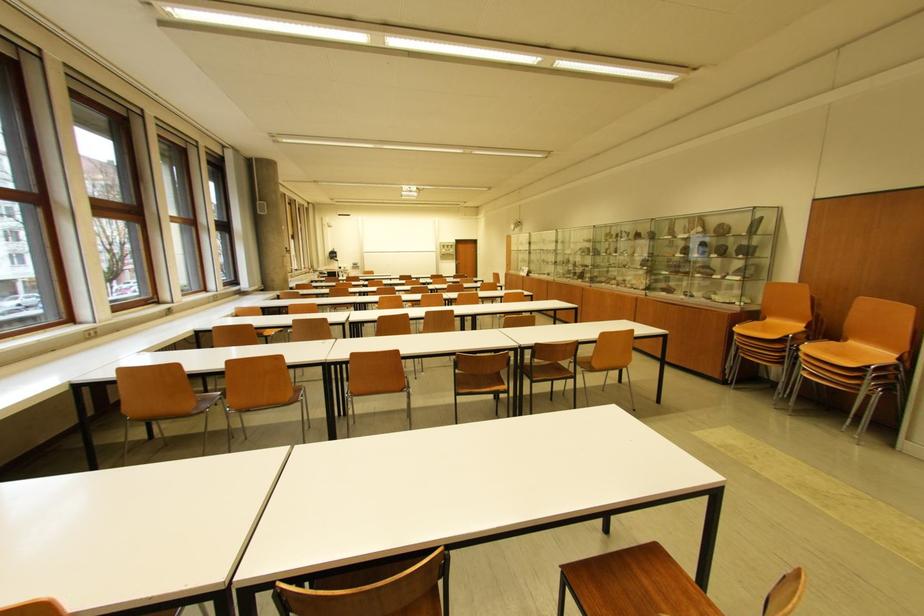
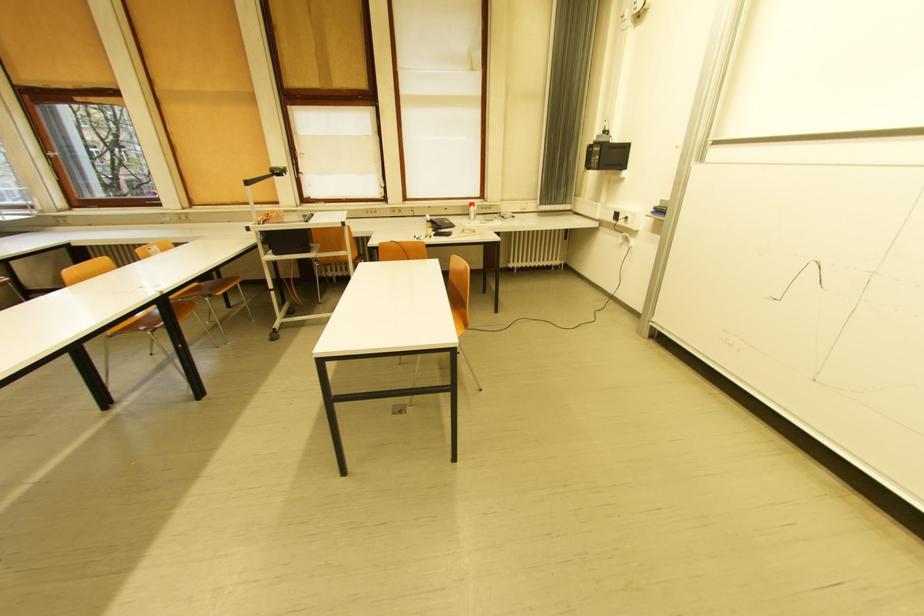
Locate, in the second image, the point that corresponds to the point at 336,257 in the first image.

(592, 168)